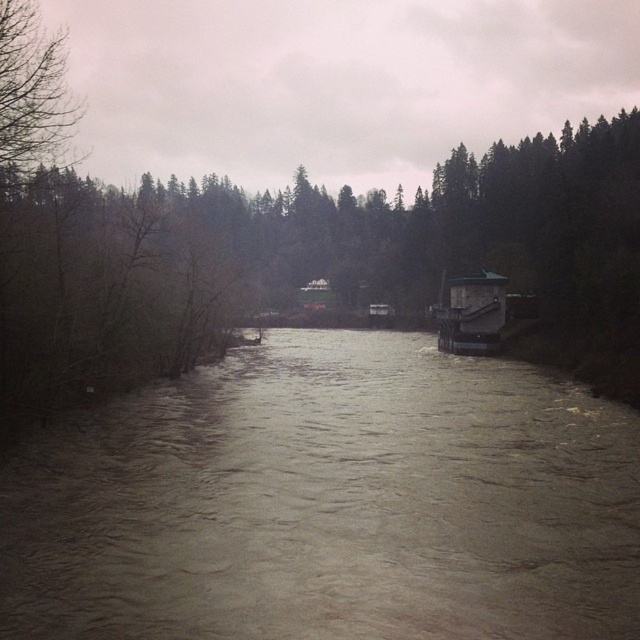
Question: Estimate the real-world distances between objects in this image. Which object is farther from the dark green matte boat at center?

Choices:
 (A) bare branches at upper left
 (B) brown muddy water at center

Answer: (A)

Question: Which point appears closest to the camera in this image?

Choices:
 (A) (637, 541)
 (B) (35, 51)

Answer: (A)

Question: Can you confirm if brown muddy water at center is smaller than brown matte tree at center?

Choices:
 (A) yes
 (B) no

Answer: (A)

Question: Does brown matte tree at center appear over dark green matte boat at center?

Choices:
 (A) yes
 (B) no

Answer: (A)

Question: Which point is closer to the camera?

Choices:
 (A) brown matte tree at center
 (B) dark green matte boat at center
 (C) bare branches at upper left

Answer: (C)

Question: Can you confirm if bare branches at upper left is positioned to the right of dark green matte boat at center?

Choices:
 (A) no
 (B) yes

Answer: (A)